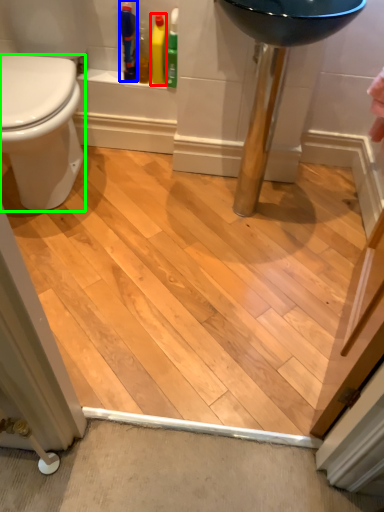
Question: Which object is positioned farthest from cleaning product (highlighted by a red box)? Select from toiletry (highlighted by a blue box) and bidet (highlighted by a green box).

Choices:
 (A) toiletry
 (B) bidet

Answer: (B)